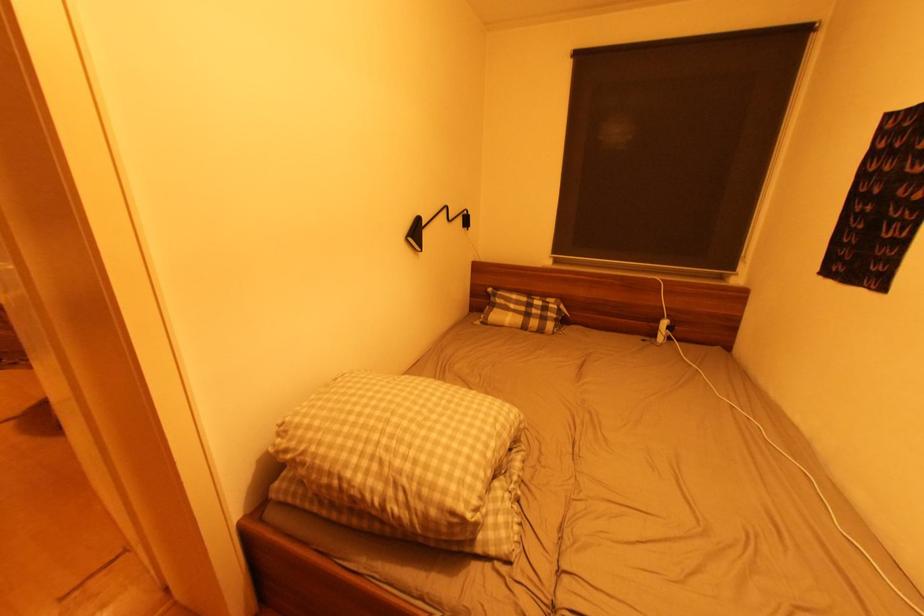
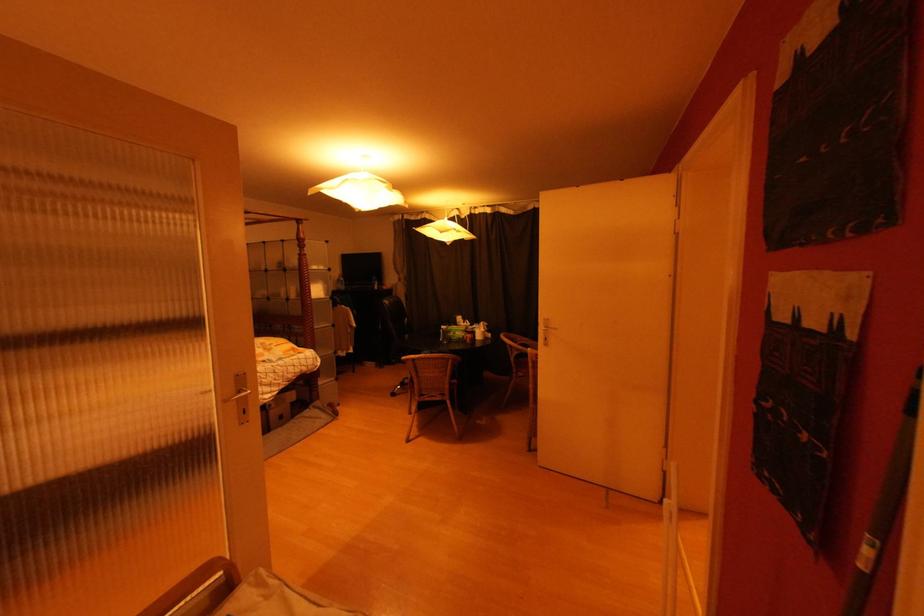
In a continuous first-person perspective shot, in which direction is the camera moving?

The cameraman walked toward left, backward.